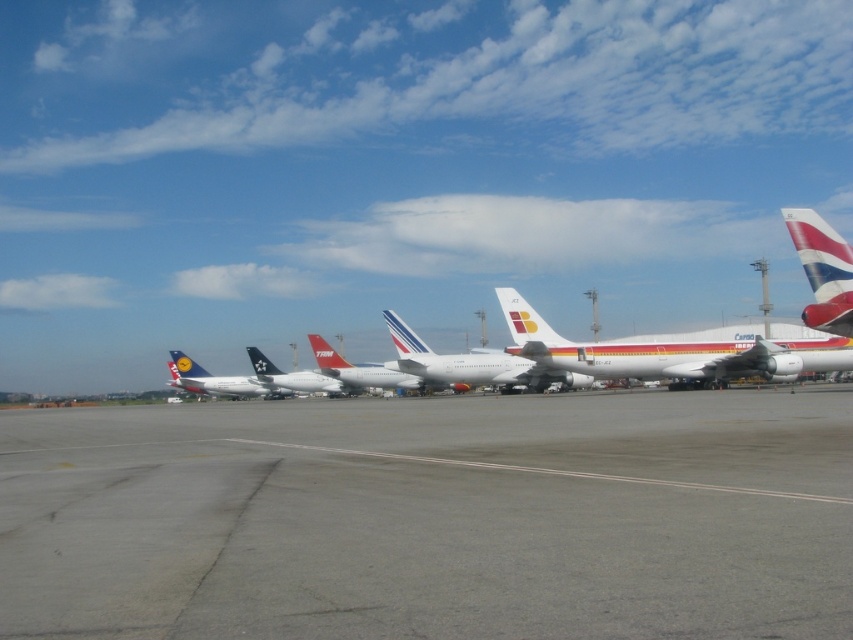
Between gray asphalt runway at center and metallic silver airplane at left, which one has less height?

gray asphalt runway at center

This screenshot has width=853, height=640. I want to click on gray asphalt runway at center, so click(432, 518).

Image resolution: width=853 pixels, height=640 pixels. I want to click on gray asphalt runway at center, so click(x=432, y=518).

Between red and white striped tail at right and metallic silver airplane at left, which one appears on the left side from the viewer's perspective?

From the viewer's perspective, metallic silver airplane at left appears more on the left side.

The height and width of the screenshot is (640, 853). What do you see at coordinates (822, 269) in the screenshot? I see `red and white striped tail at right` at bounding box center [822, 269].

You are a GUI agent. You are given a task and a screenshot of the screen. Output one action in this format:
    pyautogui.click(x=<x>, y=<y>)
    Task: Click on the red and white striped tail at right
    This screenshot has height=640, width=853.
    Given the screenshot: What is the action you would take?
    pyautogui.click(x=822, y=269)

Between white matte airplane at center and metallic silver airplane at left, which one is positioned lower?

Positioned lower is metallic silver airplane at left.

Does white matte airplane at center have a greater width compared to metallic silver airplane at left?

Incorrect, white matte airplane at center's width does not surpass metallic silver airplane at left's.

Where is `white matte airplane at center`? white matte airplane at center is located at coordinates (669, 352).

You are a GUI agent. You are given a task and a screenshot of the screen. Output one action in this format:
    pyautogui.click(x=<x>, y=<y>)
    Task: Click on the white matte airplane at center
    The width and height of the screenshot is (853, 640).
    Given the screenshot: What is the action you would take?
    pyautogui.click(x=669, y=352)